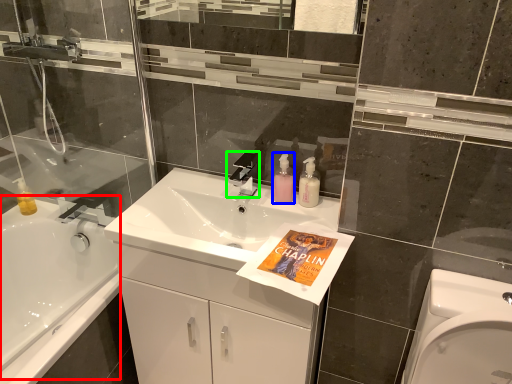
Question: Which object is the farthest from bath (highlighted by a red box)? Choose among these: toiletry (highlighted by a blue box) or tap (highlighted by a green box).

Choices:
 (A) toiletry
 (B) tap

Answer: (A)